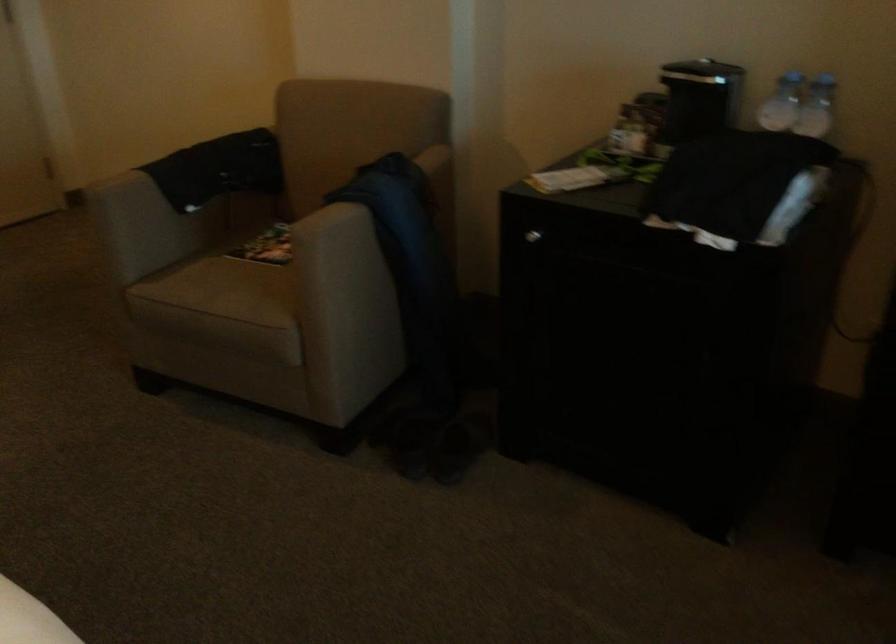
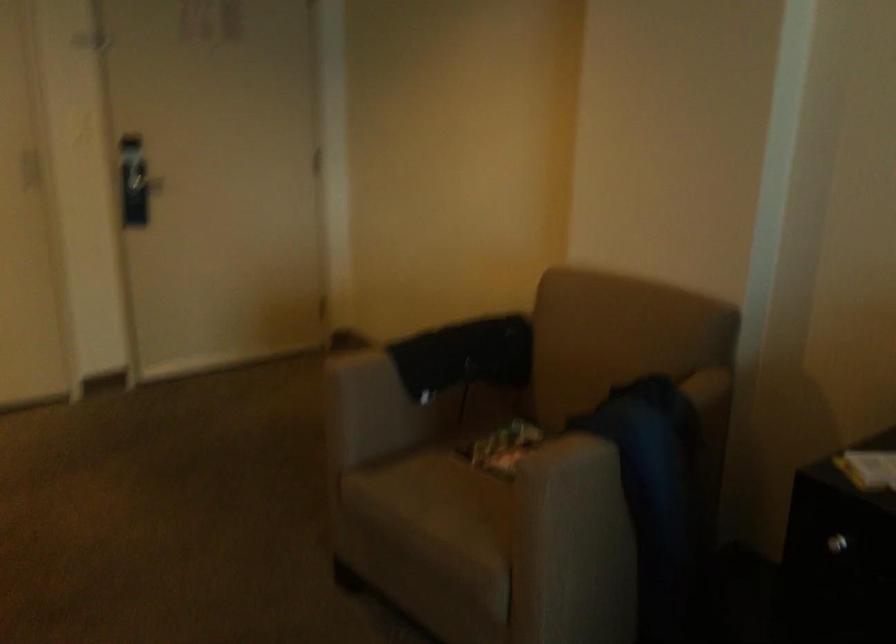
Locate, in the second image, the point that corresponds to (553,182) in the first image.

(871, 469)